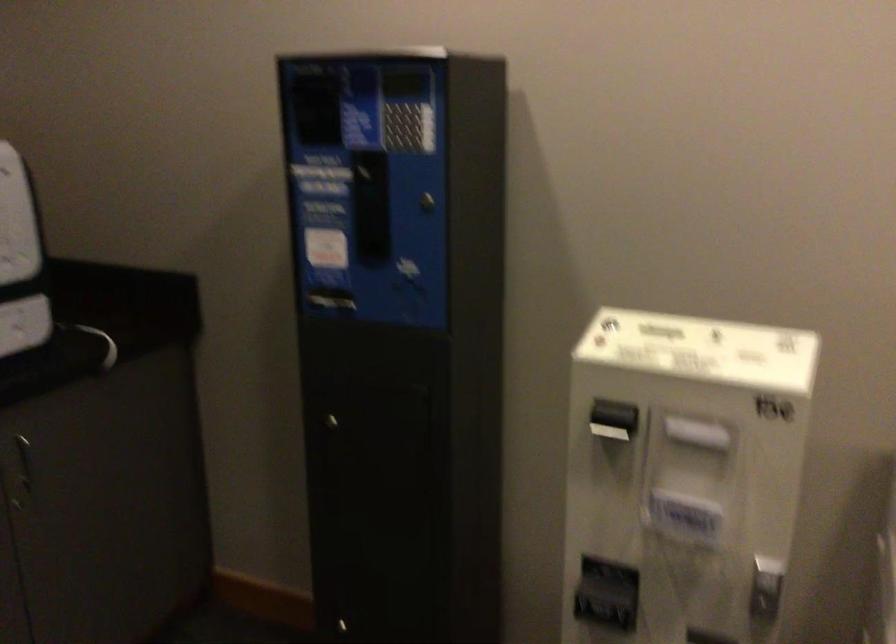
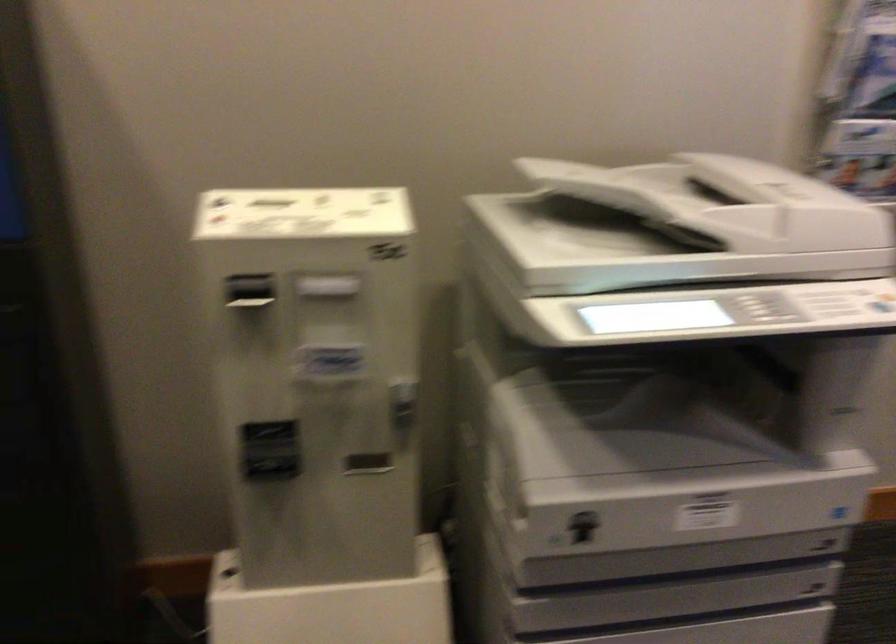
Question: Based on the continuous images, in which direction is the camera rotating? Reply with the corresponding letter.

Choices:
 (A) Left
 (B) Right
 (C) Up
 (D) Down

Answer: (B)